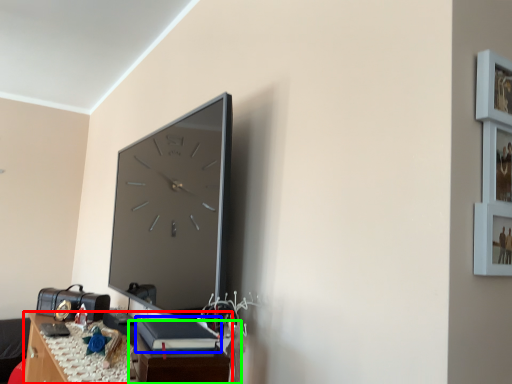
Question: Which object is the farthest from table (highlighted by a red box)? Choose among these: book (highlighted by a blue box) or table (highlighted by a green box).

Choices:
 (A) book
 (B) table

Answer: (A)